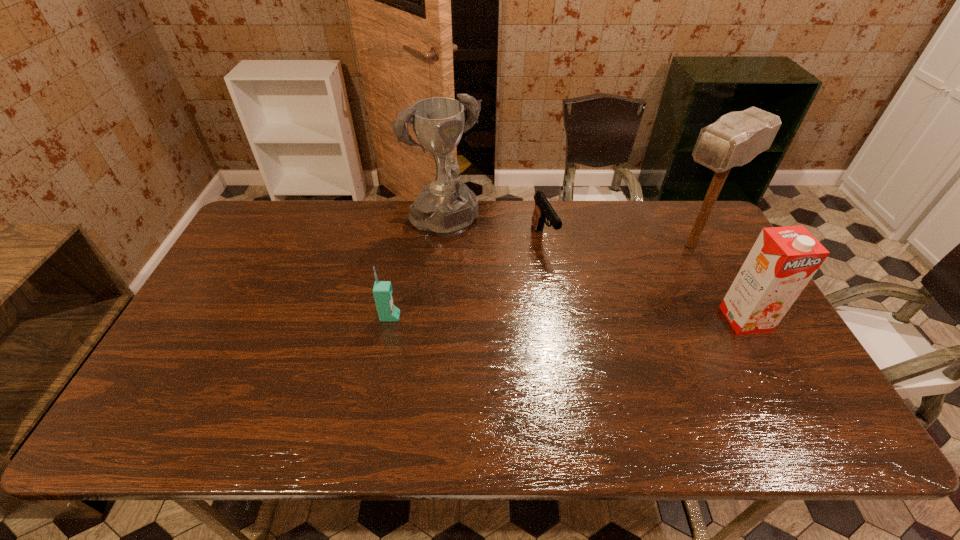
Identify the location of vacant space on the desktop that is between the fourth tallest object and the third shortest object and is positioned above the head of the mallet. The height and width of the screenshot is (540, 960). click(x=567, y=318).

This screenshot has height=540, width=960. I want to click on vacant space on the desktop that is between the cellular telephone and the third tallest object and is positioned at the barrel of the third object from left to right, so click(x=589, y=318).

Image resolution: width=960 pixels, height=540 pixels. I want to click on vacant space on the desktop that is between the cellular telephone and the third shortest object and is positioned on the side with emblem of the award, so click(519, 318).